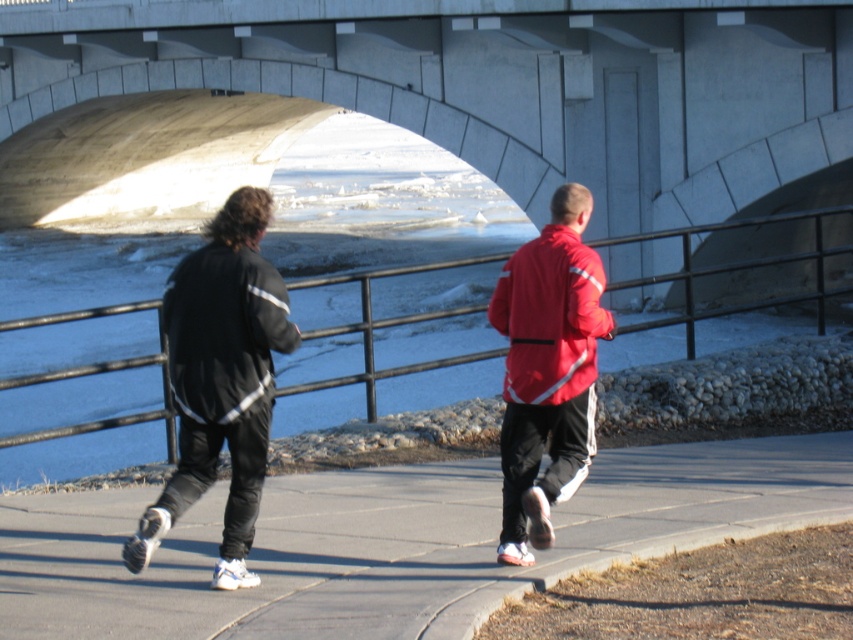
Is matte red jacket at center in front of black smooth jacket at left?

No.

Is point (567, 253) closer to viewer compared to point (258, 308)?

No, it is not.

Locate an element on the screen. matte red jacket at center is located at coordinates (548, 369).

Is point (251, 317) positioned after point (196, 307)?

No.

Between black matte jacket at left and black smooth jacket at left, which one appears on the left side from the viewer's perspective?

black matte jacket at left is more to the left.

Identify the location of black matte jacket at left. The width and height of the screenshot is (853, 640). (221, 380).

Does matte black jacket at center have a greater width compared to red matte jacket at center?

Yes, matte black jacket at center is wider than red matte jacket at center.

What do you see at coordinates (548, 369) in the screenshot? The image size is (853, 640). I see `matte black jacket at center` at bounding box center [548, 369].

Where is `matte black jacket at center`? matte black jacket at center is located at coordinates (548, 369).

This screenshot has width=853, height=640. I want to click on matte black jacket at center, so click(x=548, y=369).